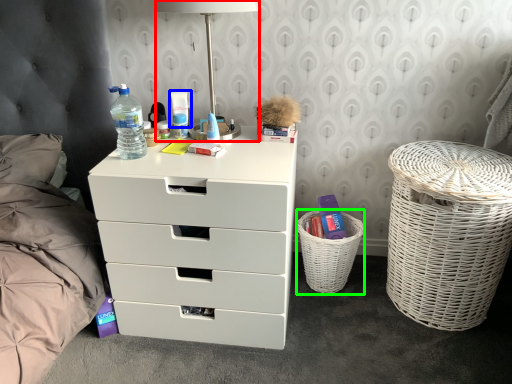
Question: Which is farther away from table lamp (highlighted by a red box)? toiletry (highlighted by a blue box) or basket (highlighted by a green box)?

Choices:
 (A) toiletry
 (B) basket

Answer: (B)